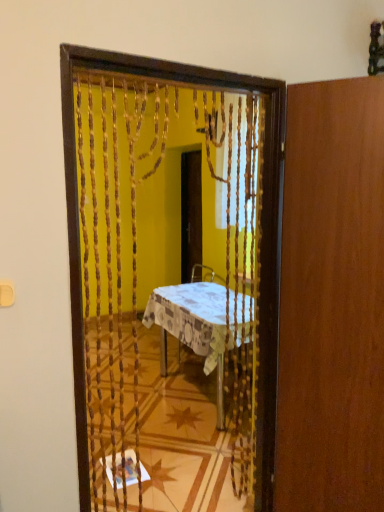
Image resolution: width=384 pixels, height=512 pixels. Find the location of `vacant point above wooden beaded curtain at center (from a real-world perspective)`. vacant point above wooden beaded curtain at center (from a real-world perspective) is located at coordinates (180, 76).